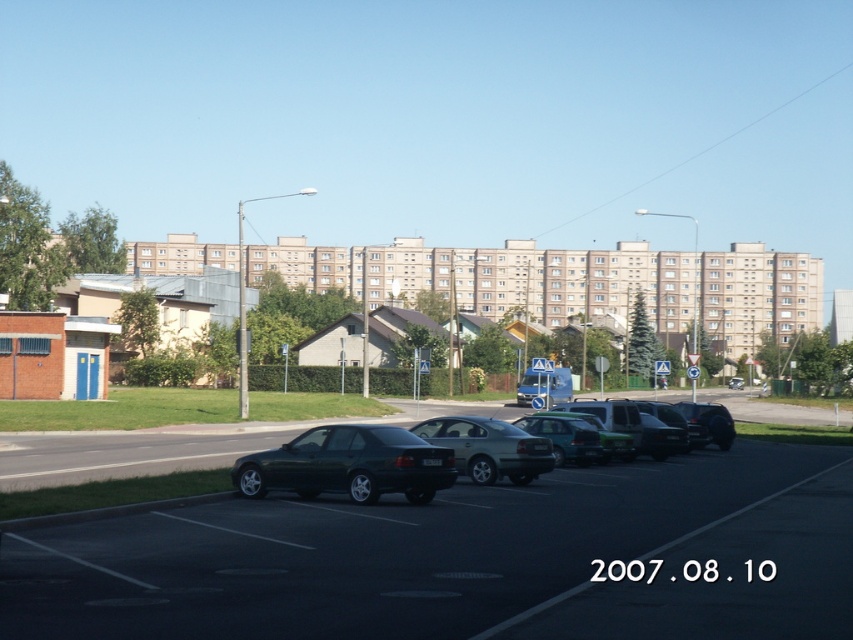
Is point (154, 595) positioned after point (548, 454)?

No, it is not.

Looking at this image, is shiny black car at center further to the viewer compared to matte gray sedan at center?

That is False.

Does point (483, 497) lie in front of point (547, 468)?

Yes, point (483, 497) is closer to viewer.

Identify the location of shiny black car at center. The image size is (853, 640). (461, 557).

Does matte gray sedan at center have a greater width compared to metallic gray sedan at center?

Correct, the width of matte gray sedan at center exceeds that of metallic gray sedan at center.

Does matte gray sedan at center have a smaller size compared to metallic gray sedan at center?

Indeed, matte gray sedan at center has a smaller size compared to metallic gray sedan at center.

Identify the location of matte gray sedan at center. The width and height of the screenshot is (853, 640). (488, 448).

Is matte gray sedan at center bigger than dark gray matte car at center?

No.

Who is positioned more to the right, matte gray sedan at center or dark gray matte car at center?

Positioned to the right is dark gray matte car at center.

Image resolution: width=853 pixels, height=640 pixels. In order to click on matte gray sedan at center in this screenshot , I will do `click(488, 448)`.